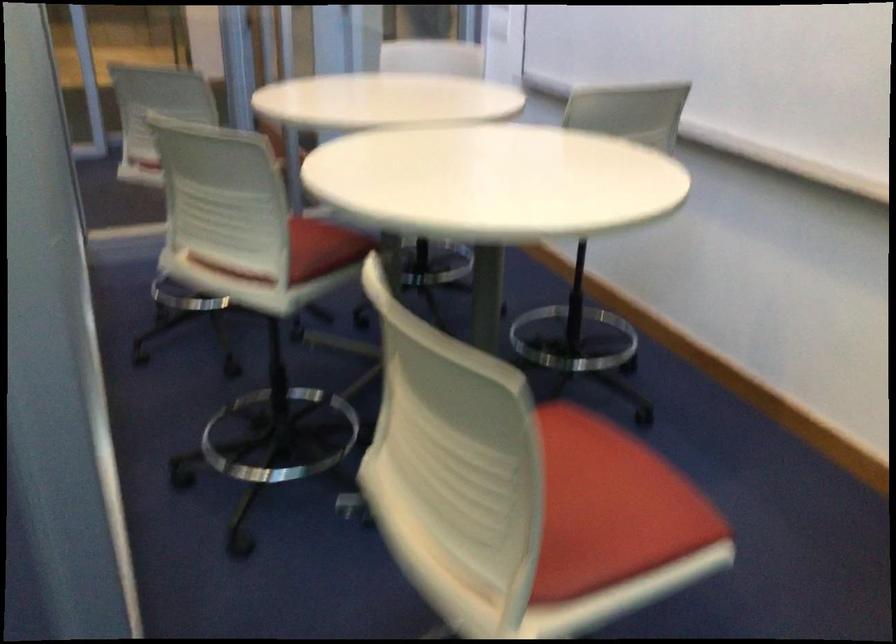
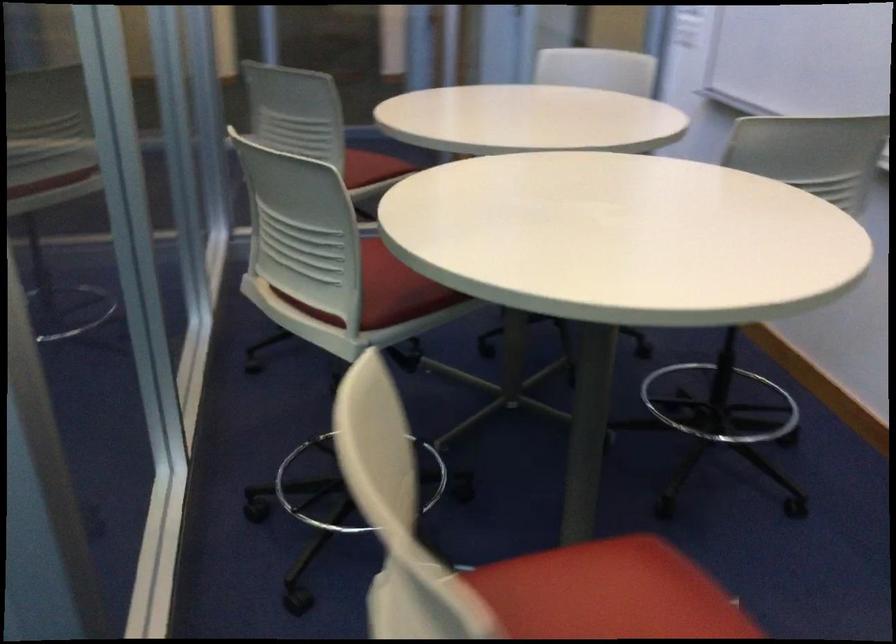
Find the pixel in the second image that matches [391,328] in the first image.

(348, 487)